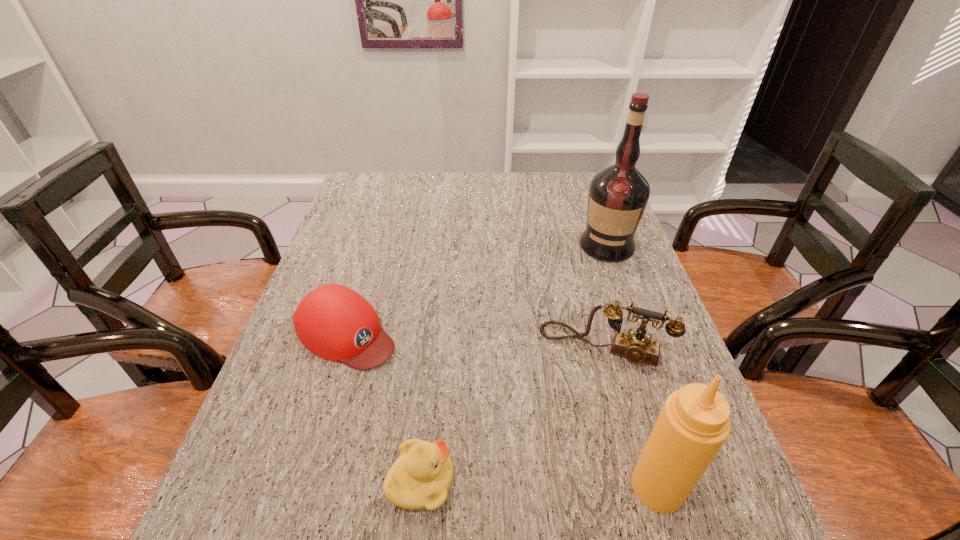
Identify the location of free space between the leftmost object and the telephone. This screenshot has width=960, height=540. (474, 339).

In order to click on free spot between the duckling and the farthest object in this screenshot , I will do `click(514, 363)`.

The image size is (960, 540). Identify the location of free spot between the fourth object from right to left and the leftmost object. (384, 407).

The image size is (960, 540). In order to click on free space between the telephone and the duckling in this screenshot , I will do `click(513, 413)`.

Where is `free spot between the liquor and the leftmost object`? This screenshot has width=960, height=540. free spot between the liquor and the leftmost object is located at coordinates (476, 289).

Locate an element on the screen. free space between the fourth object from right to left and the third shortest object is located at coordinates pos(513,413).

The image size is (960, 540). I want to click on vacant area that lies between the second object from left to right and the leftmost object, so click(384, 407).

The width and height of the screenshot is (960, 540). Find the location of `object identified as the fourth closest to the leftmost object`. object identified as the fourth closest to the leftmost object is located at coordinates (618, 195).

Image resolution: width=960 pixels, height=540 pixels. Find the location of `object that is the third closest to the farthest object`. object that is the third closest to the farthest object is located at coordinates (694, 423).